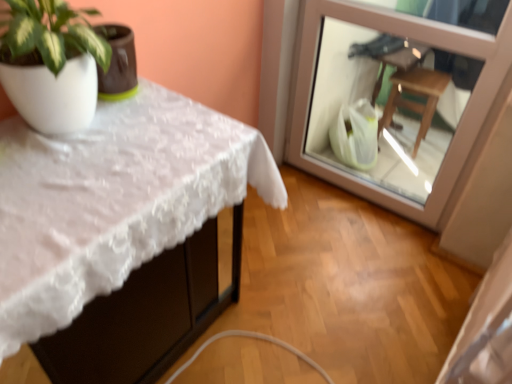
This screenshot has height=384, width=512. What do you see at coordinates (397, 98) in the screenshot?
I see `transparent glass door at upper right` at bounding box center [397, 98].

Measure the distance between point (441, 62) and camera.

They are 2.41 meters apart.

Locate an element on the screen. The image size is (512, 384). transparent glass door at upper right is located at coordinates (397, 98).

Identify the location of white lace tablecloth at upper left. The image size is (512, 384). (113, 200).

This screenshot has width=512, height=384. Describe the element at coordinates (113, 200) in the screenshot. I see `white lace tablecloth at upper left` at that location.

The width and height of the screenshot is (512, 384). I want to click on transparent glass door at upper right, so click(397, 98).

Consider the image. Between transparent glass door at upper right and white lace tablecloth at upper left, which one appears on the left side from the viewer's perspective?

white lace tablecloth at upper left.

Between transparent glass door at upper right and white lace tablecloth at upper left, which one is positioned in front?

white lace tablecloth at upper left is more forward.

Which is farther, [305,40] or [56,149]?

Positioned behind is point [305,40].

From the image's perspective, is transparent glass door at upper right above or below white lace tablecloth at upper left?

transparent glass door at upper right is above white lace tablecloth at upper left.

From a real-world perspective, is transparent glass door at upper right located higher than white lace tablecloth at upper left?

Yes, from a real-world perspective, transparent glass door at upper right is over white lace tablecloth at upper left

Looking at this image, does transparent glass door at upper right have a lesser width compared to white lace tablecloth at upper left?

Yes.

Considering the relative sizes of transparent glass door at upper right and white lace tablecloth at upper left in the image provided, is transparent glass door at upper right taller than white lace tablecloth at upper left?

Indeed, transparent glass door at upper right has a greater height compared to white lace tablecloth at upper left.

Who is bigger, transparent glass door at upper right or white lace tablecloth at upper left?

With larger size is white lace tablecloth at upper left.

Would you say transparent glass door at upper right is inside or outside white lace tablecloth at upper left?

transparent glass door at upper right exists outside the volume of white lace tablecloth at upper left.

Is transparent glass door at upper right in contact with white lace tablecloth at upper left?

They are not placed beside each other.

Is transparent glass door at upper right facing away from white lace tablecloth at upper left?

No, transparent glass door at upper right's orientation is not away from white lace tablecloth at upper left.

What's the angular difference between transparent glass door at upper right and white lace tablecloth at upper left's facing directions?

The facing directions of transparent glass door at upper right and white lace tablecloth at upper left are 89.8 degrees apart.

How distant is transparent glass door at upper right from white lace tablecloth at upper left?

transparent glass door at upper right is 1.18 meters from white lace tablecloth at upper left.

You are a GUI agent. You are given a task and a screenshot of the screen. Output one action in this format:
    pyautogui.click(x=<x>, y=<y>)
    Task: Click on the table below the transparent glass door at upper right (from a real-world perspective)
    This screenshot has height=384, width=512.
    Given the screenshot: What is the action you would take?
    pyautogui.click(x=113, y=200)

Which is more to the right, white lace tablecloth at upper left or transparent glass door at upper right?

transparent glass door at upper right.

Which object is closer to the camera, white lace tablecloth at upper left or transparent glass door at upper right?

white lace tablecloth at upper left.

Does point (7, 135) lie behind point (409, 34)?

No, it is not.

From the image's perspective, which one is positioned lower, white lace tablecloth at upper left or transparent glass door at upper right?

white lace tablecloth at upper left is shown below in the image.

From a real-world perspective, which object stands above the other?

transparent glass door at upper right is physically above.

Is white lace tablecloth at upper left thinner than transparent glass door at upper right?

In fact, white lace tablecloth at upper left might be wider than transparent glass door at upper right.

Does white lace tablecloth at upper left have a greater height compared to transparent glass door at upper right?

No, white lace tablecloth at upper left is not taller than transparent glass door at upper right.

Considering the sizes of white lace tablecloth at upper left and transparent glass door at upper right in the image, is white lace tablecloth at upper left bigger or smaller than transparent glass door at upper right?

white lace tablecloth at upper left is bigger than transparent glass door at upper right.

Is white lace tablecloth at upper left situated inside transparent glass door at upper right or outside?

white lace tablecloth at upper left cannot be found inside transparent glass door at upper right.

Are white lace tablecloth at upper left and transparent glass door at upper right beside each other?

white lace tablecloth at upper left is not next to transparent glass door at upper right, and they're not touching.

Is white lace tablecloth at upper left positioned with its back to transparent glass door at upper right?

No, white lace tablecloth at upper left is not facing away from transparent glass door at upper right.

What's the angular difference between white lace tablecloth at upper left and transparent glass door at upper right's facing directions?

There is a 89.8-degree angle between the facing directions of white lace tablecloth at upper left and transparent glass door at upper right.

The height and width of the screenshot is (384, 512). I want to click on table that is below the transparent glass door at upper right (from the image's perspective), so click(113, 200).

Where is `table in front of the transparent glass door at upper right`? The height and width of the screenshot is (384, 512). table in front of the transparent glass door at upper right is located at coordinates (113, 200).

You are a GUI agent. You are given a task and a screenshot of the screen. Output one action in this format:
    pyautogui.click(x=<x>, y=<y>)
    Task: Click on the glass door to the right of white lace tablecloth at upper left
    The height and width of the screenshot is (384, 512).
    Given the screenshot: What is the action you would take?
    pyautogui.click(x=397, y=98)